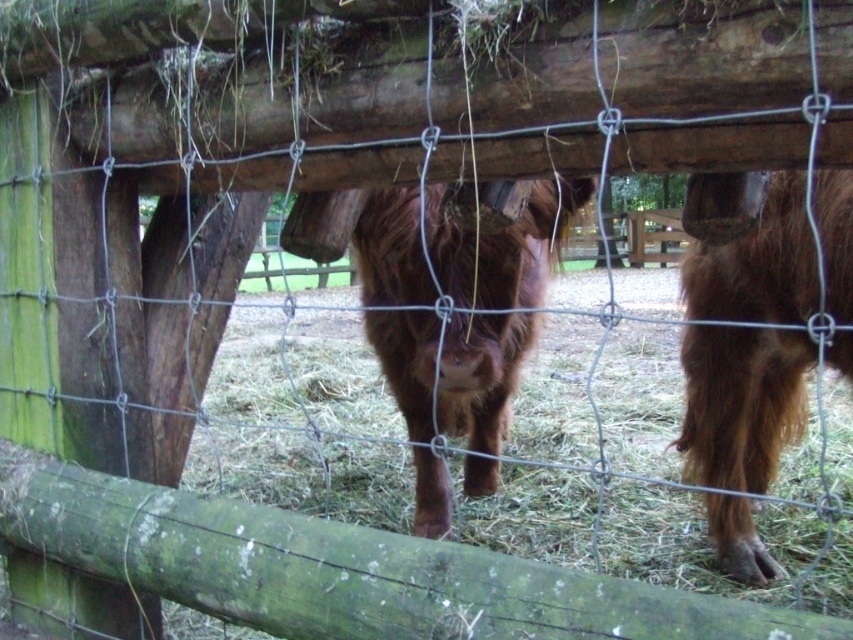
Question: Can you confirm if brown fuzzy cow at right is positioned to the right of brown fuzzy cow at center?

Choices:
 (A) no
 (B) yes

Answer: (B)

Question: Is brown fuzzy cow at right to the left of brown fuzzy cow at center from the viewer's perspective?

Choices:
 (A) no
 (B) yes

Answer: (A)

Question: Which point is closer to the camera taking this photo?

Choices:
 (A) (689, 380)
 (B) (418, 524)

Answer: (A)

Question: In this image, where is brown fuzzy cow at right located relative to brown fuzzy cow at center?

Choices:
 (A) right
 (B) left

Answer: (A)

Question: Which object appears farthest from the camera in this image?

Choices:
 (A) brown fuzzy cow at right
 (B) brown fuzzy cow at center

Answer: (B)